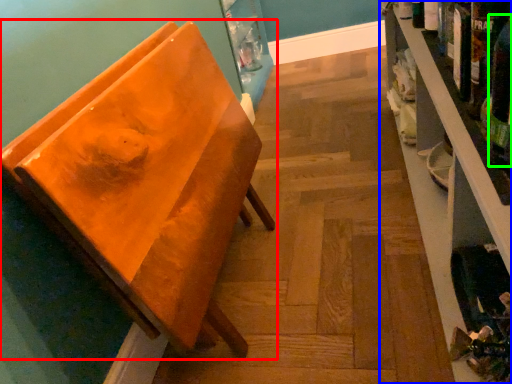
Question: Which is farther away from furniture (highlighted by a red box)? shelf (highlighted by a blue box) or beer bottle (highlighted by a green box)?

Choices:
 (A) shelf
 (B) beer bottle

Answer: (B)